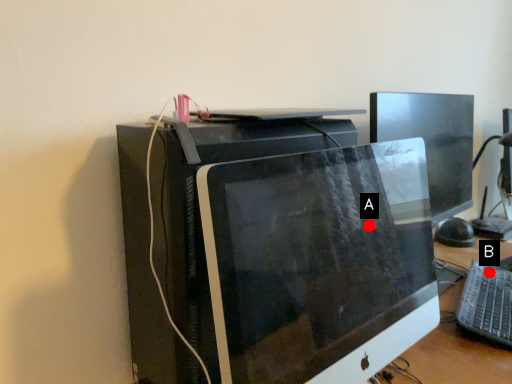
Question: Two points are circled on the image, labeled by A and B beside each circle. Which point appears closest to the camera in this image?

Choices:
 (A) A is closer
 (B) B is closer

Answer: (A)